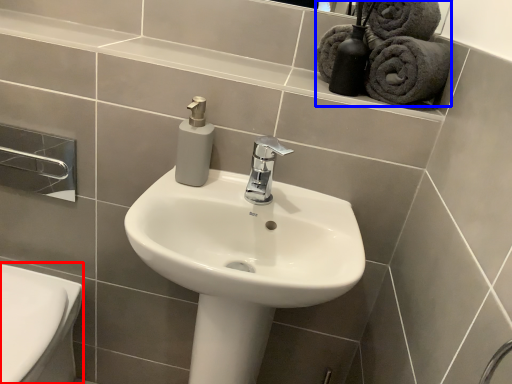
Question: Which point is closer to the camera, bidet (highlighted by a red box) or bath towel (highlighted by a blue box)?

Choices:
 (A) bidet
 (B) bath towel

Answer: (B)